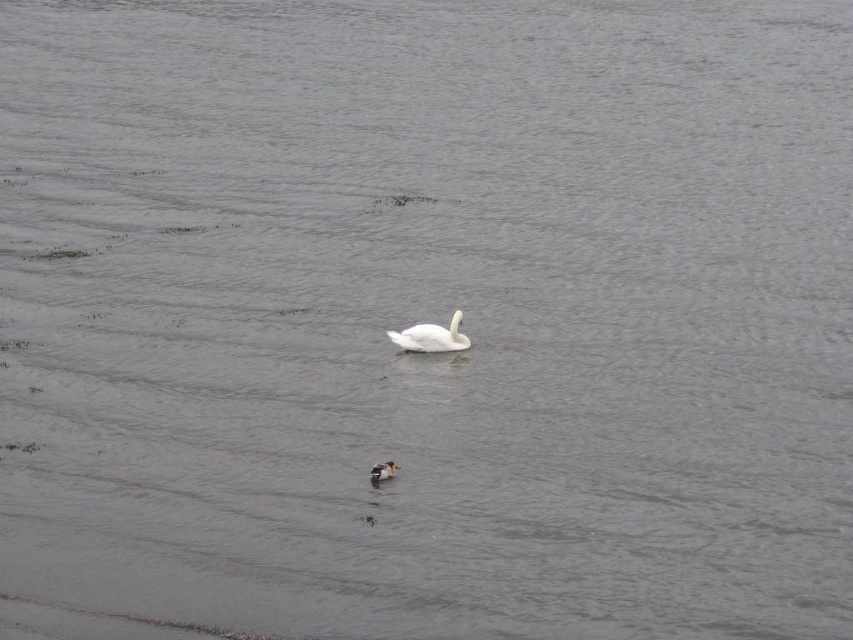
Consider the image. You are a photographer trying to capture both the white smooth swan at center and the brown speckled duck at center in a single shot. Your camera has a maximum focus range of 3 meters. Can you fit both birds in the frame without moving the camera?

The white smooth swan at center and brown speckled duck at center are 2.72 meters apart from each other, which is within the camera maximum focus range of 3 meters. Therefore, you can fit both birds in the frame without moving the camera.

You are a photographer trying to capture both the white smooth swan at center and the brown speckled duck at center in a single frame. Given their sizes, which bird will appear larger in your photo?

The white smooth swan at center will appear larger in the photo because its width is larger than the brown speckled duck at center.